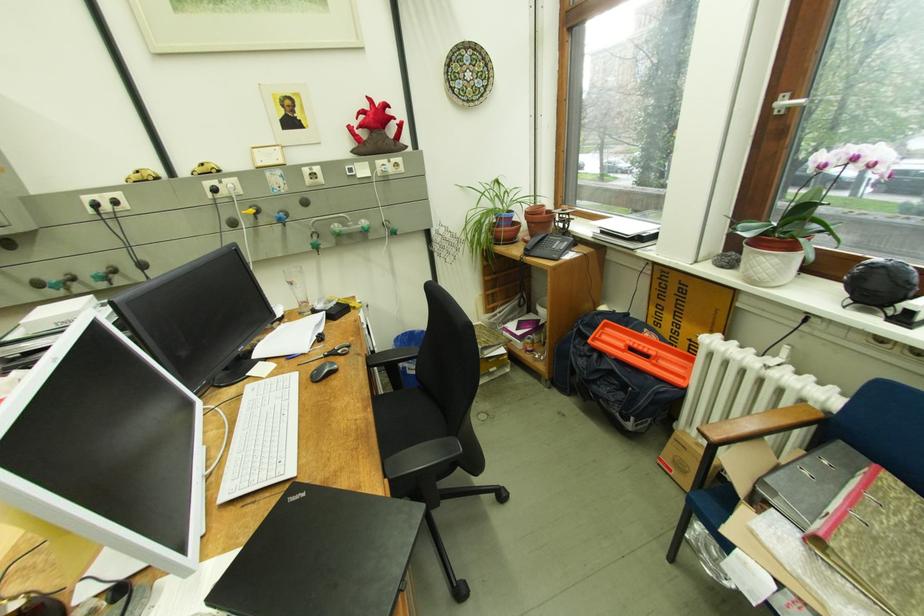
Identify the location of silver window handle. (786, 103).